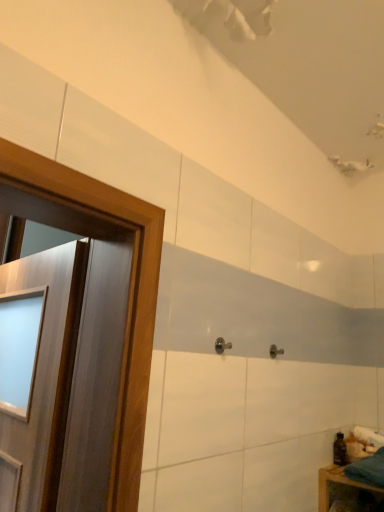
Question: Is teal fabric at lower right inside the boundaries of wooden door at left, or outside?

Choices:
 (A) inside
 (B) outside

Answer: (B)

Question: From the image's perspective, is teal fabric at lower right above or below wooden door at left?

Choices:
 (A) above
 (B) below

Answer: (B)

Question: Based on their relative distances, which object is nearer to the teal fabric at lower right?

Choices:
 (A) wooden door at left
 (B) satin nickel door handle at center
 (C) transparent plastic bottle at lower right

Answer: (C)

Question: Which object is the closest to the teal fabric at lower right?

Choices:
 (A) wooden door at left
 (B) satin nickel door handle at center
 (C) transparent plastic bottle at lower right

Answer: (C)